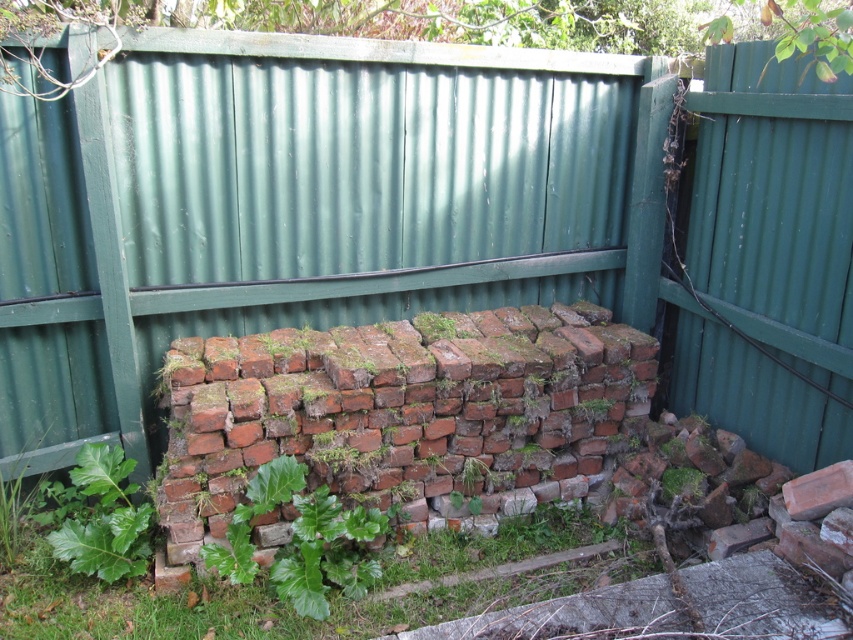
Does green leafy plant at center have a smaller size compared to green leafy plant at lower left?

Actually, green leafy plant at center might be larger than green leafy plant at lower left.

Between green leafy plant at center and green leafy plant at lower left, which one is positioned lower?

Positioned lower is green leafy plant at center.

Measure the distance between green leafy plant at center and camera.

They are 2.43 meters apart.

Find the location of a particular element. green leafy plant at center is located at coordinates (300, 540).

Which of these two, reddish-brown bricks at center or green leafy plant at center, stands taller?

Standing taller between the two is reddish-brown bricks at center.

Who is lower down, reddish-brown bricks at center or green leafy plant at center?

green leafy plant at center is below.

Which is behind, point (418, 416) or point (282, 477)?

The point (418, 416) is behind.

Find the location of a particular element. reddish-brown bricks at center is located at coordinates (403, 410).

Describe the element at coordinates (403, 410) in the screenshot. I see `reddish-brown bricks at center` at that location.

Between reddish-brown bricks at center and green leafy grass at lower center, which one appears on the left side from the viewer's perspective?

green leafy grass at lower center is more to the left.

Is point (537, 326) farther from viewer compared to point (28, 557)?

Yes, it is behind point (28, 557).

Find the location of a particular element. This screenshot has height=640, width=853. reddish-brown bricks at center is located at coordinates [x=403, y=410].